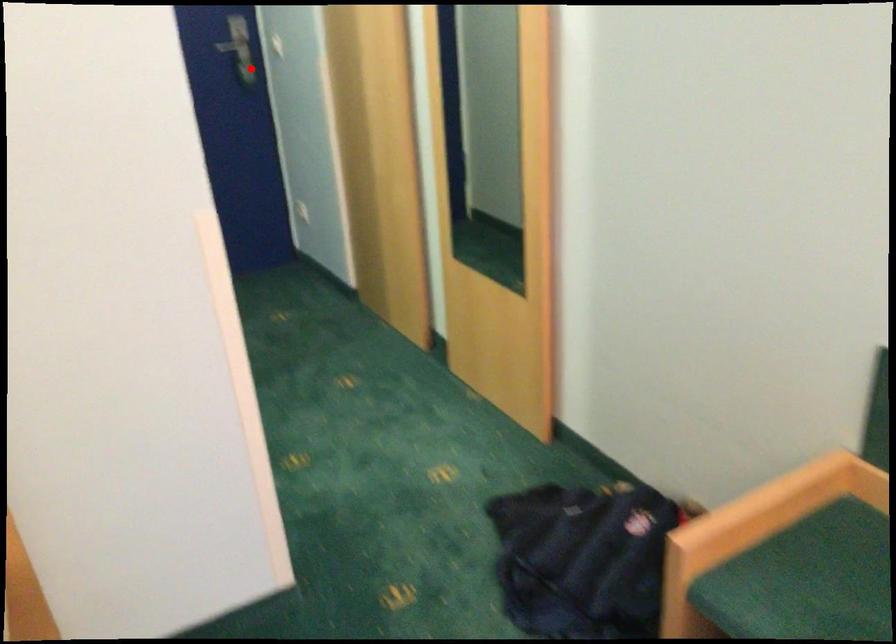
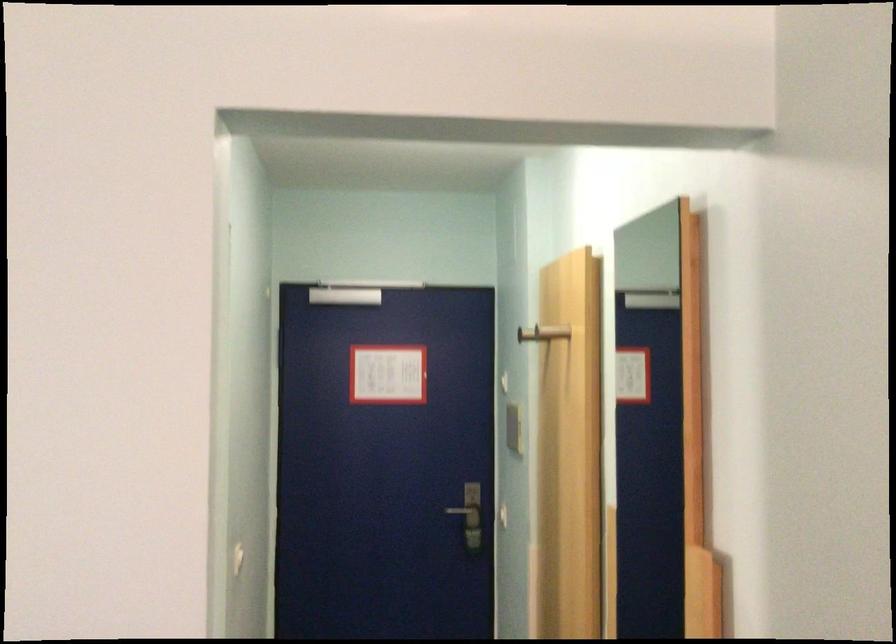
The point at the highlighted location is marked in the first image. Where is the corresponding point in the second image?

(470, 526)